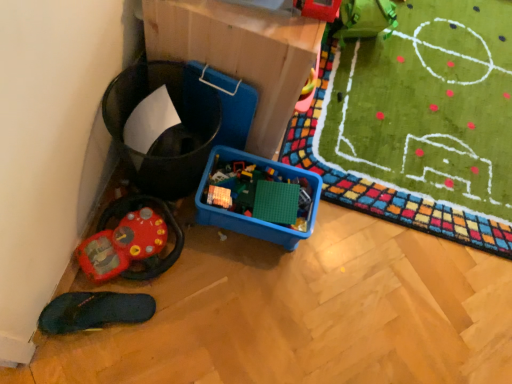
Question: Does rubberized plastic toy at upper right, acting as the 2th toy starting from the back, contain black rubber slipper at lower left?

Choices:
 (A) yes
 (B) no

Answer: (B)

Question: Is the depth of rubberized plastic toy at upper right, marked as the 2th toy in a left-to-right arrangement, less than that of black rubber slipper at lower left?

Choices:
 (A) no
 (B) yes

Answer: (B)

Question: Can you confirm if rubberized plastic toy at upper right, marked as the 2th toy in a left-to-right arrangement, is taller than black rubber slipper at lower left?

Choices:
 (A) yes
 (B) no

Answer: (A)

Question: From a real-world perspective, is rubberized plastic toy at upper right, marked as the 1th toy in a top-to-bottom arrangement, located higher than black rubber slipper at lower left?

Choices:
 (A) yes
 (B) no

Answer: (A)

Question: From a real-world perspective, is rubberized plastic toy at upper right, which is the 1th toy in right-to-left order, positioned under black rubber slipper at lower left based on gravity?

Choices:
 (A) yes
 (B) no

Answer: (B)

Question: Is rubberized plastic toy at upper right, marked as the 2th toy in a left-to-right arrangement, wider than black rubber slipper at lower left?

Choices:
 (A) yes
 (B) no

Answer: (B)

Question: Considering the relative sizes of rubberized red steering wheel at lower left, which is the 1th toy from bottom to top, and rubberized plastic toy at upper right, marked as the 1th toy in a top-to-bottom arrangement, in the image provided, is rubberized red steering wheel at lower left, which is the 1th toy from bottom to top, smaller than rubberized plastic toy at upper right, marked as the 1th toy in a top-to-bottom arrangement,?

Choices:
 (A) yes
 (B) no

Answer: (B)

Question: Is rubberized red steering wheel at lower left, acting as the 2th toy starting from the front, turned away from rubberized plastic toy at upper right, marked as the 2th toy in a left-to-right arrangement?

Choices:
 (A) no
 (B) yes

Answer: (A)

Question: From the image's perspective, does rubberized red steering wheel at lower left, which appears as the first toy when viewed from the back, appear lower than rubberized plastic toy at upper right, marked as the 1th toy in a top-to-bottom arrangement?

Choices:
 (A) yes
 (B) no

Answer: (A)

Question: Does rubberized red steering wheel at lower left, acting as the 2th toy starting from the front, appear on the right side of rubberized plastic toy at upper right, the second toy from the bottom?

Choices:
 (A) no
 (B) yes

Answer: (A)

Question: Are rubberized red steering wheel at lower left, which appears as the first toy when viewed from the back, and rubberized plastic toy at upper right, acting as the 2th toy starting from the back, making contact?

Choices:
 (A) yes
 (B) no

Answer: (B)

Question: From a real-world perspective, is rubberized red steering wheel at lower left, which appears as the second toy when viewed from the right, located higher than rubberized plastic toy at upper right, marked as the 1th toy in a top-to-bottom arrangement?

Choices:
 (A) yes
 (B) no

Answer: (B)

Question: Does cardboard at upper center come in front of rubberized red steering wheel at lower left, acting as the 2th toy starting from the front?

Choices:
 (A) yes
 (B) no

Answer: (A)